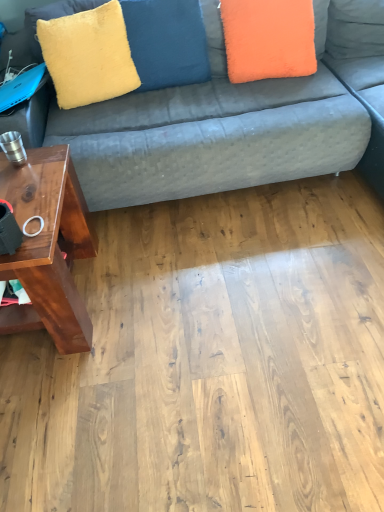
Question: Is yellow plush pillow at upper center, positioned as the 2th pillow in right-to-left order, smaller than velvet fabric couch at upper center?

Choices:
 (A) yes
 (B) no

Answer: (A)

Question: From a real-world perspective, is yellow plush pillow at upper center, acting as the 1th pillow starting from the left, located beneath velvet fabric couch at upper center?

Choices:
 (A) no
 (B) yes

Answer: (A)

Question: Does yellow plush pillow at upper center, positioned as the 2th pillow in right-to-left order, have a greater height compared to velvet fabric couch at upper center?

Choices:
 (A) yes
 (B) no

Answer: (B)

Question: Can you confirm if yellow plush pillow at upper center, positioned as the 2th pillow in right-to-left order, is bigger than velvet fabric couch at upper center?

Choices:
 (A) yes
 (B) no

Answer: (B)

Question: From the image's perspective, does yellow plush pillow at upper center, acting as the 1th pillow starting from the left, appear lower than velvet fabric couch at upper center?

Choices:
 (A) yes
 (B) no

Answer: (B)

Question: Is yellow plush pillow at upper center, acting as the 1th pillow starting from the left, oriented away from velvet fabric couch at upper center?

Choices:
 (A) no
 (B) yes

Answer: (B)

Question: Considering the relative positions of brown wood table at left and yellow fuzzy pillow at upper left in the image provided, is brown wood table at left to the right of yellow fuzzy pillow at upper left from the viewer's perspective?

Choices:
 (A) no
 (B) yes

Answer: (A)

Question: Does brown wood table at left come behind yellow fuzzy pillow at upper left?

Choices:
 (A) yes
 (B) no

Answer: (B)

Question: Is brown wood table at left in front of yellow fuzzy pillow at upper left?

Choices:
 (A) yes
 (B) no

Answer: (A)

Question: Is yellow fuzzy pillow at upper left completely or partially inside brown wood table at left?

Choices:
 (A) yes
 (B) no

Answer: (B)

Question: Can you confirm if brown wood table at left is taller than yellow fuzzy pillow at upper left?

Choices:
 (A) yes
 (B) no

Answer: (A)

Question: Is brown wood table at left not close to yellow fuzzy pillow at upper left?

Choices:
 (A) yes
 (B) no

Answer: (B)

Question: Can you confirm if yellow plush pillow at upper center, positioned as the 2th pillow in right-to-left order, is positioned to the left of yellow fuzzy pillow at upper left?

Choices:
 (A) no
 (B) yes

Answer: (A)